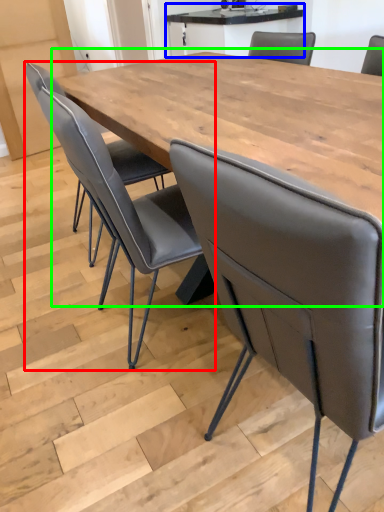
Question: Which object is positioned closest to chair (highlighted by a red box)? Select from table (highlighted by a blue box) and table (highlighted by a green box).

Choices:
 (A) table
 (B) table

Answer: (B)